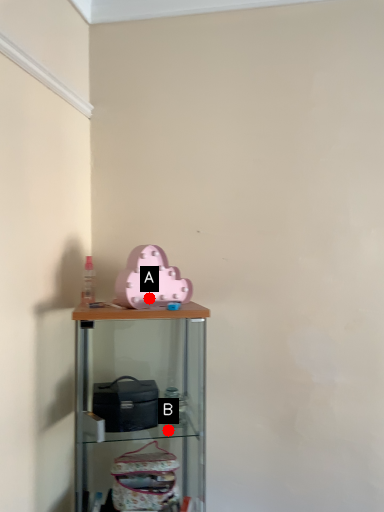
Question: Two points are circled on the image, labeled by A and B beside each circle. Which point is further to the camera?

Choices:
 (A) A is further
 (B) B is further

Answer: (B)